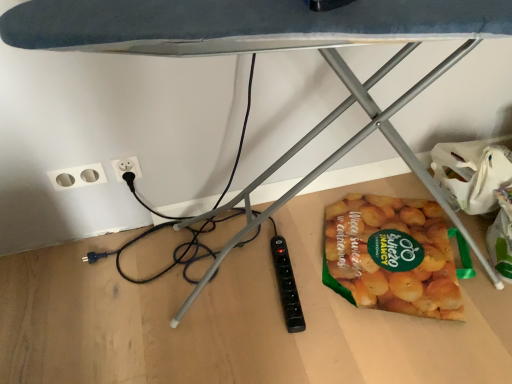
Question: Is white plastic electric outlet at lower left inside the boundaries of translucent plastic bag of sliced potatoes at lower right, or outside?

Choices:
 (A) outside
 (B) inside

Answer: (A)

Question: Does point (125, 163) appear closer or farther from the camera than point (369, 261)?

Choices:
 (A) farther
 (B) closer

Answer: (B)

Question: Based on their relative distances, which object is nearer to the white plastic electric outlet at lower left?

Choices:
 (A) white plastic socket at lower left
 (B) translucent plastic bag of sliced potatoes at lower right

Answer: (A)

Question: Based on their relative distances, which object is farther from the white plastic socket at lower left?

Choices:
 (A) translucent plastic bag of sliced potatoes at lower right
 (B) white plastic electric outlet at lower left

Answer: (A)